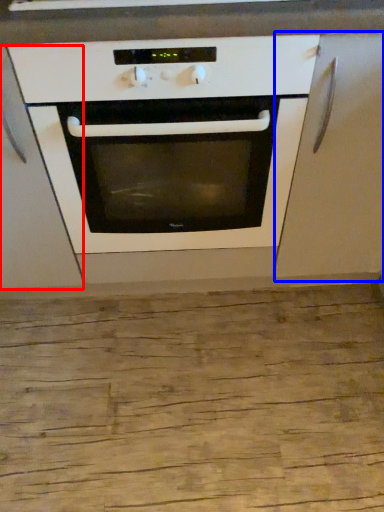
Question: Among these objects, which one is farthest to the camera, cabinetry (highlighted by a red box) or cabinetry (highlighted by a blue box)?

Choices:
 (A) cabinetry
 (B) cabinetry

Answer: (B)